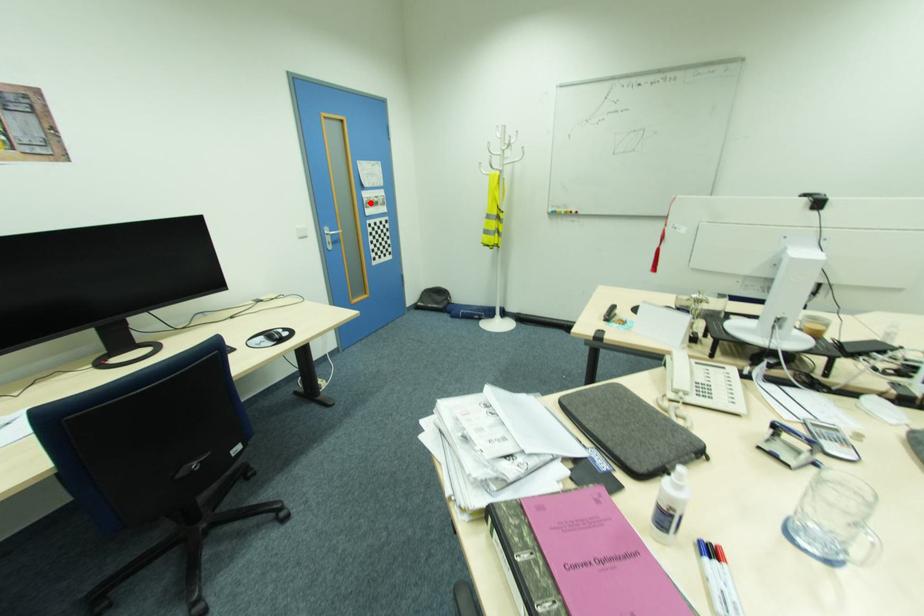
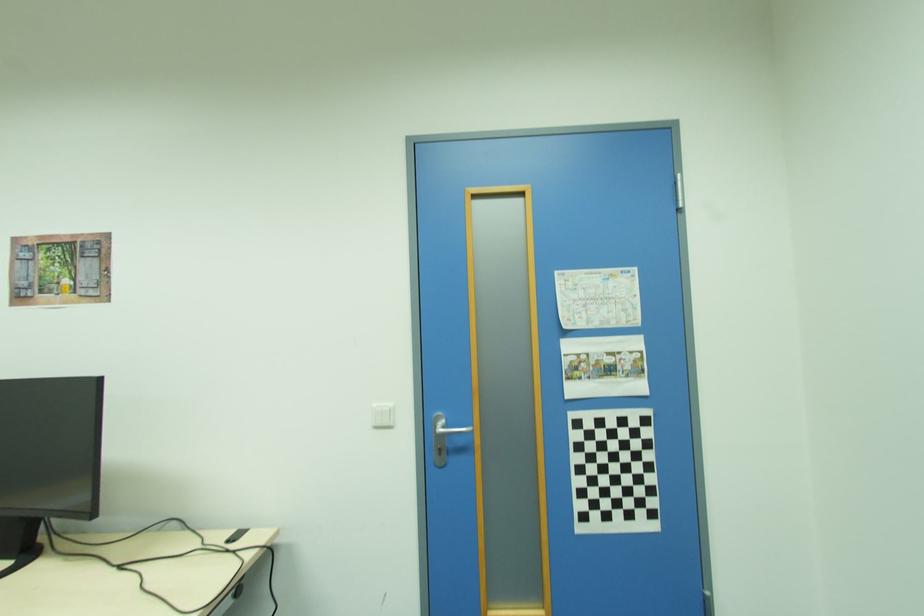
Question: I am providing you with two images of the same scene from different viewpoints. Image1 has a red point marked. In image2, the corresponding 3D location appears at what relative position? Reply with the corresponding letter.

Choices:
 (A) Closer
 (B) Farther

Answer: (B)